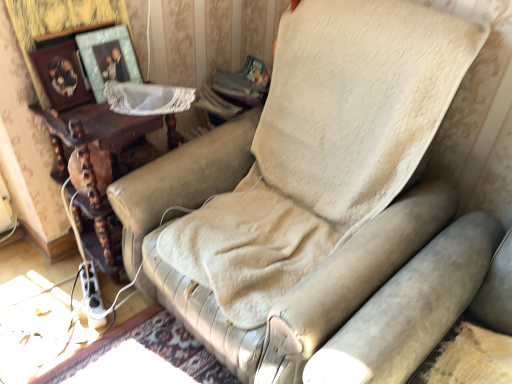
This screenshot has height=384, width=512. Identify the location of vacant area that is situated to the right of wooden photo frame at upper left, which is the first picture frame in left-to-right order. (97, 113).